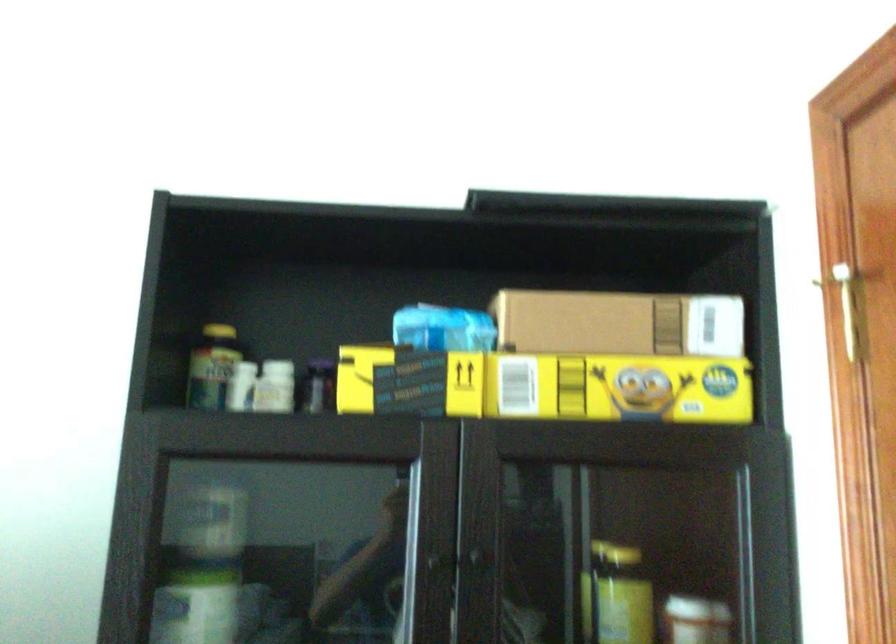
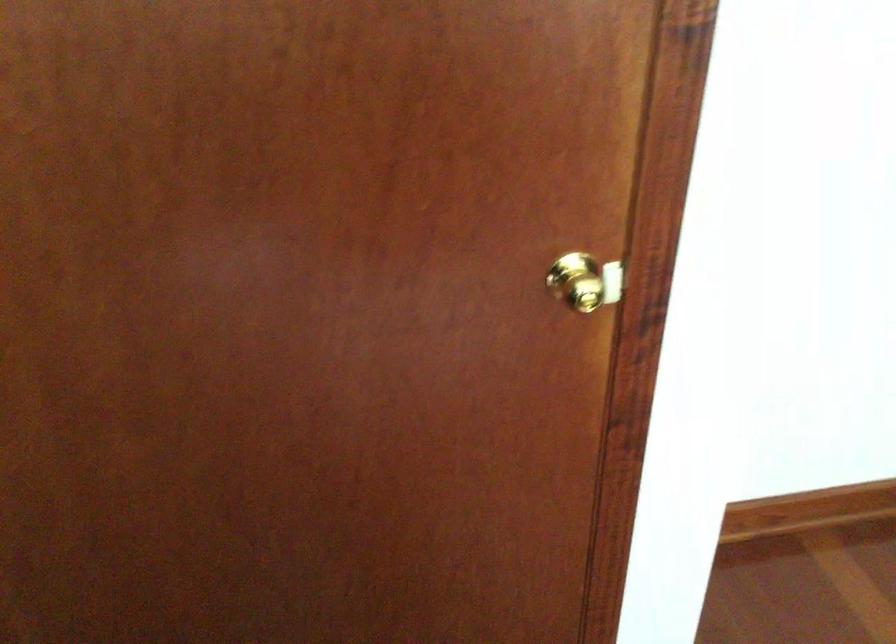
The first image is from the beginning of the video and the second image is from the end. How did the camera likely rotate when shooting the video?

The camera's rotation is toward right-down.